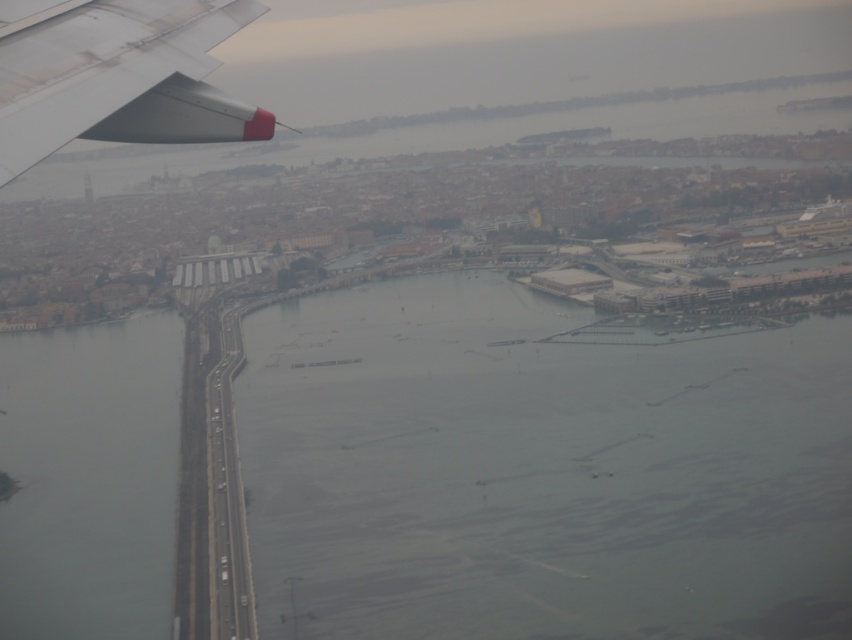
Question: Which object is positioned closest to the gray water at center?

Choices:
 (A) matte white wing at upper left
 (B) gray concrete bridge at lower left

Answer: (B)

Question: Observing the image, what is the correct spatial positioning of gray water at center in reference to matte white wing at upper left?

Choices:
 (A) left
 (B) right

Answer: (B)

Question: Does gray concrete bridge at lower left appear on the right side of matte white wing at upper left?

Choices:
 (A) yes
 (B) no

Answer: (B)

Question: Is gray concrete bridge at lower left to the right of matte white wing at upper left from the viewer's perspective?

Choices:
 (A) no
 (B) yes

Answer: (A)

Question: Which point appears farthest from the camera in this image?

Choices:
 (A) (751, 330)
 (B) (44, 432)

Answer: (B)

Question: Which object is the closest to the gray water at center?

Choices:
 (A) gray concrete bridge at lower left
 (B) matte white wing at upper left

Answer: (A)